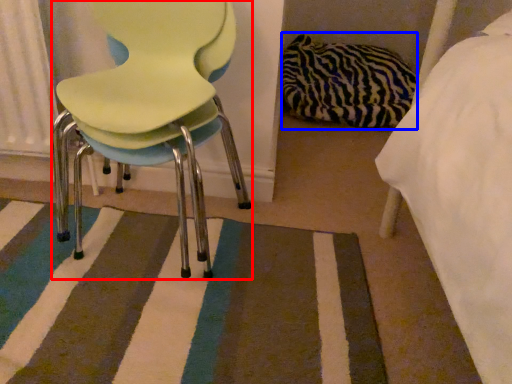
Question: Among these objects, which one is nearest to the camera, chair (highlighted by a red box) or material (highlighted by a blue box)?

Choices:
 (A) chair
 (B) material

Answer: (A)